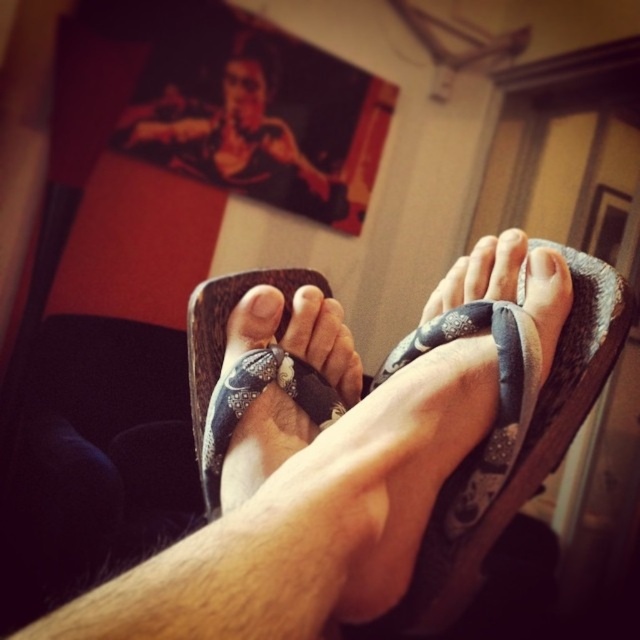
You are designing a shoe display and need to arrange the white matte toe at center and the matte gray sandal at center next to each other. Which one should be placed first if you want the larger item to be on the left side?

The white matte toe at center has a larger size compared to matte gray sandal at center, so place the white matte toe at center on the left side and the matte gray sandal at center on the right side to follow the desired arrangement.